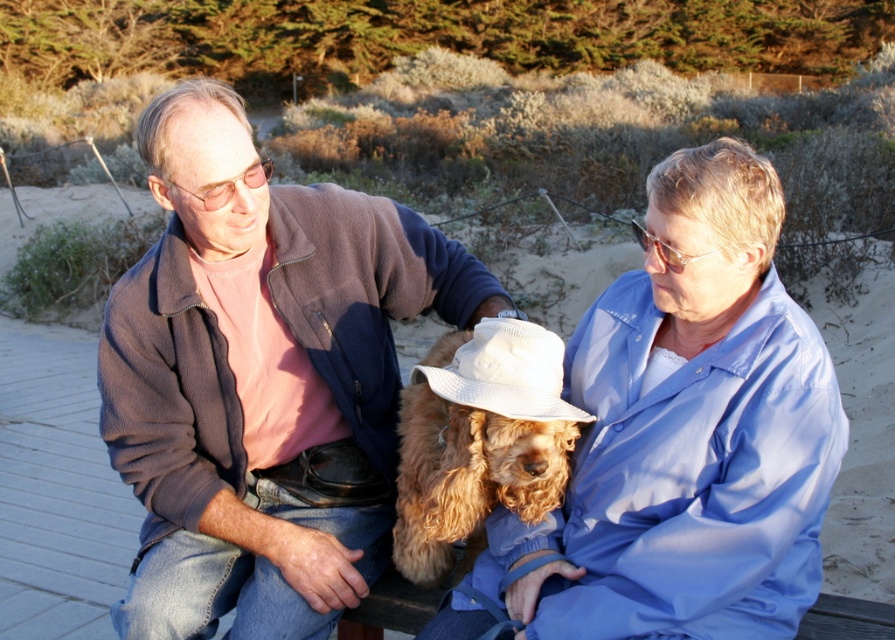
Question: Among these objects, which one is farthest from the camera?

Choices:
 (A) fuzzy brown dog at center
 (B) light blue fabric shirt at center
 (C) matte brown jacket at left

Answer: (C)

Question: Can you confirm if matte brown jacket at left is bigger than fuzzy brown dog at center?

Choices:
 (A) yes
 (B) no

Answer: (A)

Question: Which point appears farthest from the camera in this image?

Choices:
 (A) (286, 186)
 (B) (478, 460)

Answer: (A)

Question: Which object appears closest to the camera in this image?

Choices:
 (A) matte brown jacket at left
 (B) fuzzy brown dog at center

Answer: (B)

Question: Is matte brown jacket at left bigger than light blue fabric shirt at center?

Choices:
 (A) yes
 (B) no

Answer: (A)

Question: Can you confirm if matte brown jacket at left is positioned to the right of fuzzy brown dog at center?

Choices:
 (A) yes
 (B) no

Answer: (B)